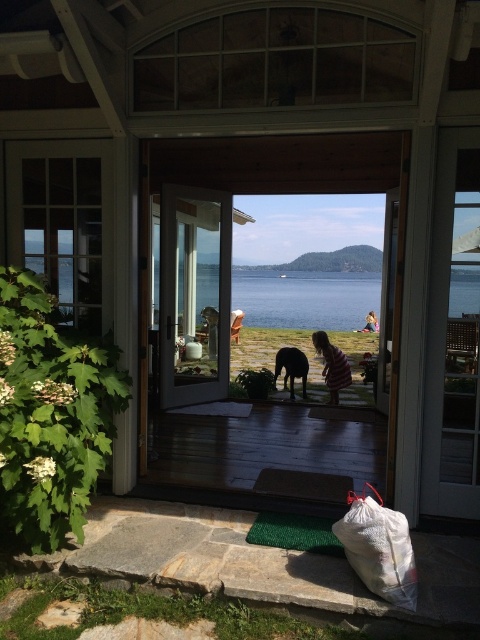
You are standing inside a house and looking through the clear glass screen door at center. There is a point marked at coordinates (193,294). What object is located at this point?

The point at coordinates (193,294) indicates the clear glass screen door at center.

In the scene shown: You are standing inside the house looking through the glass door. You see the blue water at center and the shiny black dog at center. Which object appears taller from your vantage point?

The blue water at center appears taller than the shiny black dog at center from your vantage point.

You are standing on the porch and looking through the glass door. There are two points marked on the glass door at coordinates point (448,310) and point (304,369). Which point is closer to your eyes?

Point (448,310) is closer to the viewer than point (304,369), so the point at (448,310) is closer to your eyes.